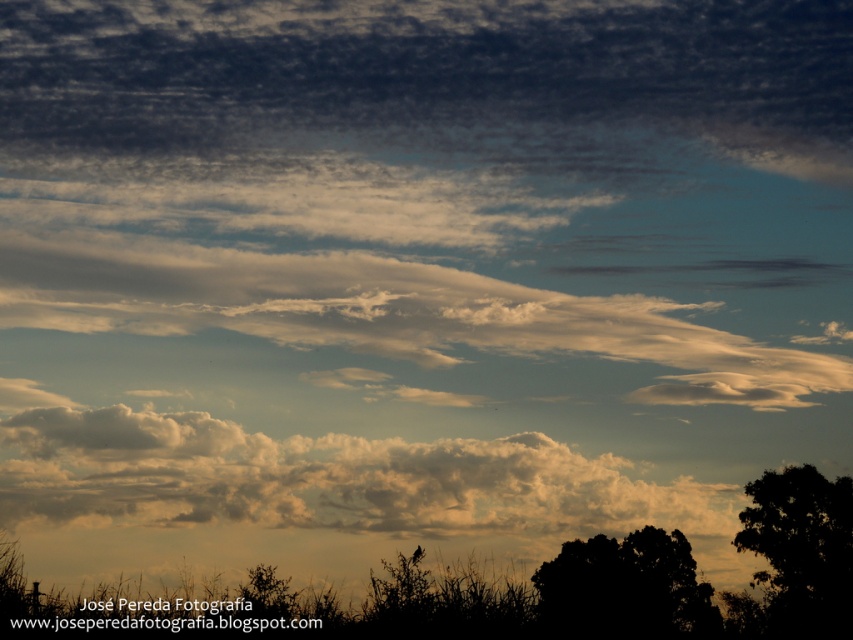
Question: Among these points, which one is farthest from the camera?

Choices:
 (A) (201, 40)
 (B) (740, 593)
 (C) (354, 460)

Answer: (A)

Question: Does cloudy white at lower center have a lesser width compared to black matte tree at lower right?

Choices:
 (A) no
 (B) yes

Answer: (A)

Question: Where is white fluffy cloud at center located in relation to cloudy white at lower center in the image?

Choices:
 (A) above
 (B) below

Answer: (A)

Question: Does dark gray textured cloud at upper center appear under cloudy white at lower center?

Choices:
 (A) yes
 (B) no

Answer: (B)

Question: Estimate the real-world distances between objects in this image. Which object is farther from the black matte tree at lower right?

Choices:
 (A) dark gray textured cloud at upper center
 (B) dark green leafy tree at lower right

Answer: (A)

Question: Which is farther from the dark green leafy tree at lower right?

Choices:
 (A) black matte tree at lower right
 (B) white fluffy cloud at center
 (C) dark gray textured cloud at upper center

Answer: (C)